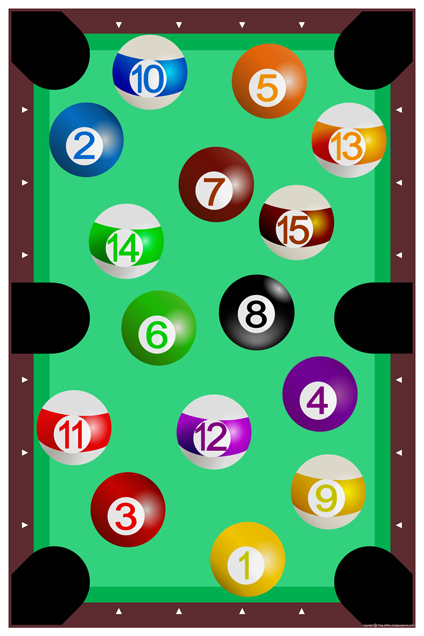
In order to click on cushions in this screenshot , I will do `click(36, 481)`, `click(151, 595)`, `click(388, 409)`, `click(220, 43)`.